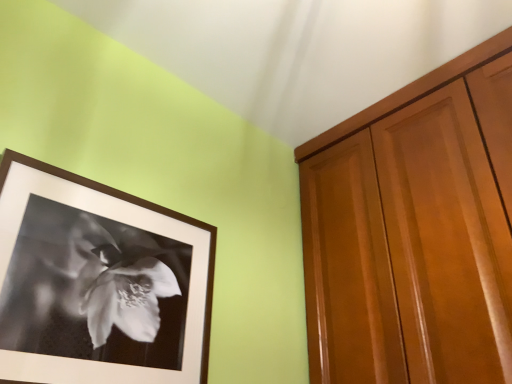
Question: Considering the relative sizes of black matte picture frame at upper left and glossy wood cabinetry at right in the image provided, is black matte picture frame at upper left shorter than glossy wood cabinetry at right?

Choices:
 (A) yes
 (B) no

Answer: (A)

Question: Does black matte picture frame at upper left have a greater height compared to glossy wood cabinetry at right?

Choices:
 (A) no
 (B) yes

Answer: (A)

Question: Can you confirm if black matte picture frame at upper left is positioned to the left of glossy wood cabinetry at right?

Choices:
 (A) yes
 (B) no

Answer: (A)

Question: Is black matte picture frame at upper left thinner than glossy wood cabinetry at right?

Choices:
 (A) yes
 (B) no

Answer: (A)

Question: From the image's perspective, is black matte picture frame at upper left over glossy wood cabinetry at right?

Choices:
 (A) yes
 (B) no

Answer: (B)

Question: Can you confirm if black matte picture frame at upper left is smaller than glossy wood cabinetry at right?

Choices:
 (A) yes
 (B) no

Answer: (A)

Question: Does glossy wood cabinetry at right have a larger size compared to black matte picture frame at upper left?

Choices:
 (A) yes
 (B) no

Answer: (A)

Question: Considering the relative sizes of glossy wood cabinetry at right and black matte picture frame at upper left in the image provided, is glossy wood cabinetry at right thinner than black matte picture frame at upper left?

Choices:
 (A) yes
 (B) no

Answer: (B)

Question: Does glossy wood cabinetry at right turn towards black matte picture frame at upper left?

Choices:
 (A) yes
 (B) no

Answer: (A)

Question: From the image's perspective, would you say glossy wood cabinetry at right is shown under black matte picture frame at upper left?

Choices:
 (A) no
 (B) yes

Answer: (A)

Question: From a real-world perspective, is glossy wood cabinetry at right below black matte picture frame at upper left?

Choices:
 (A) yes
 (B) no

Answer: (B)

Question: Is black matte picture frame at upper left a part of glossy wood cabinetry at right?

Choices:
 (A) yes
 (B) no

Answer: (B)

Question: From a real-world perspective, is black matte picture frame at upper left physically located above or below glossy wood cabinetry at right?

Choices:
 (A) below
 (B) above

Answer: (A)